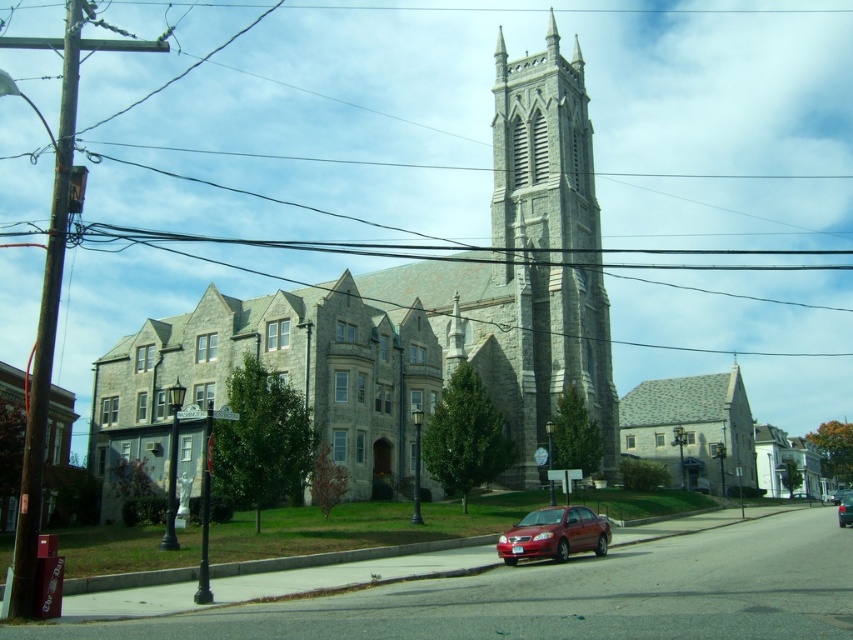
Who is lower down, gray stone tower at center or gray stone church at lower right?

Positioned lower is gray stone church at lower right.

Does gray stone tower at center have a larger size compared to gray stone church at lower right?

No.

Is point (602, 314) closer to camera compared to point (709, 387)?

That is True.

Image resolution: width=853 pixels, height=640 pixels. I want to click on gray stone tower at center, so click(x=544, y=252).

Is gray stone church at center closer to camera compared to shiny red sedan at center?

That is False.

Between gray stone church at center and shiny red sedan at center, which one is positioned lower?

Positioned lower is shiny red sedan at center.

What do you see at coordinates (413, 314) in the screenshot? I see `gray stone church at center` at bounding box center [413, 314].

Where is `gray stone church at center`? This screenshot has height=640, width=853. gray stone church at center is located at coordinates (413, 314).

Does gray stone church at lower right have a smaller size compared to metallic red sedan at center?

No, gray stone church at lower right is not smaller than metallic red sedan at center.

Is gray stone church at lower right shorter than metallic red sedan at center?

No.

What do you see at coordinates (692, 429) in the screenshot? I see `gray stone church at lower right` at bounding box center [692, 429].

This screenshot has width=853, height=640. I want to click on gray stone church at lower right, so click(692, 429).